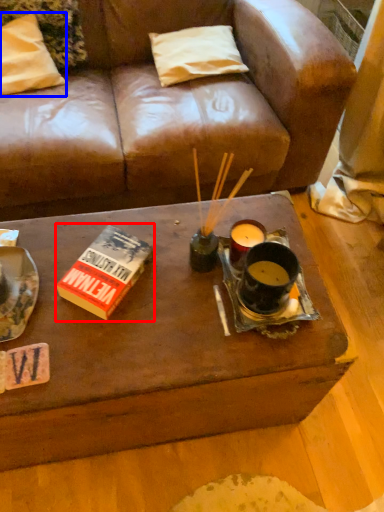
Question: Which object appears closest to the camera in this image, paperback book (highlighted by a red box) or pillow (highlighted by a blue box)?

Choices:
 (A) paperback book
 (B) pillow

Answer: (A)